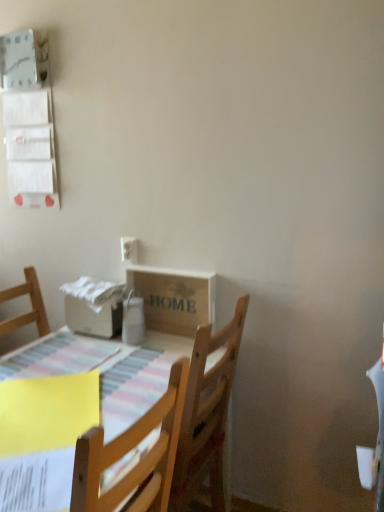
In order to face wooden table at lower left, should I rotate leftwards or rightwards?

You should look left and rotate roughly 14.095 degrees.

The width and height of the screenshot is (384, 512). In order to click on wooden table at lower left in this screenshot , I will do `click(105, 370)`.

Between wooden crate at center and wooden table at lower left, which one is positioned behind?

wooden crate at center is further from the camera.

Is wooden crate at center facing away from wooden table at lower left?

No, wooden table at lower left is not at the back of wooden crate at center.

This screenshot has width=384, height=512. Find the location of `table in front of the wooden crate at center`. table in front of the wooden crate at center is located at coordinates (105, 370).

Is wooden crate at center taller than white plastic electric outlet at upper left?

Indeed, wooden crate at center has a greater height compared to white plastic electric outlet at upper left.

Can you confirm if wooden crate at center is bigger than white plastic electric outlet at upper left?

Indeed, wooden crate at center has a larger size compared to white plastic electric outlet at upper left.

From a real-world perspective, is wooden crate at center over white plastic electric outlet at upper left?

No.

Locate an element on the screen. cardboard box below the white plastic electric outlet at upper left (from a real-world perspective) is located at coordinates (174, 298).

Is wooden table at lower left turned away from wooden crate at center?

No, wooden crate at center is not at the back of wooden table at lower left.

From a real-world perspective, is wooden table at lower left under wooden crate at center?

Yes.

Is point (122, 344) closer or farther from the camera than point (204, 297)?

Point (122, 344) is positioned farther from the camera compared to point (204, 297).

Can you confirm if wooden table at lower left is smaller than wooden crate at center?

Actually, wooden table at lower left might be larger than wooden crate at center.

Looking at this image, from the image's perspective, is white plastic electric outlet at upper left under wooden table at lower left?

Incorrect, from the image's perspective, white plastic electric outlet at upper left is higher than wooden table at lower left.

Locate an element on the screen. This screenshot has width=384, height=512. electric outlet that appears on the right of wooden table at lower left is located at coordinates (129, 250).

Is white plastic electric outlet at upper left with wooden table at lower left?

No, white plastic electric outlet at upper left is not beside wooden table at lower left.

Can you confirm if wooden table at lower left is wider than white plastic electric outlet at upper left?

Indeed, wooden table at lower left has a greater width compared to white plastic electric outlet at upper left.

From the image's perspective, which is above, wooden table at lower left or white plastic electric outlet at upper left?

white plastic electric outlet at upper left.

Who is more distant, wooden table at lower left or white plastic electric outlet at upper left?

Positioned behind is white plastic electric outlet at upper left.

Is wooden table at lower left bigger than white plastic electric outlet at upper left?

Yes.

From the picture: Who is shorter, white plastic electric outlet at upper left or wooden crate at center?

Standing shorter between the two is white plastic electric outlet at upper left.

Is white plastic electric outlet at upper left touching wooden crate at center?

They are not placed beside each other.

Considering the relative sizes of white plastic electric outlet at upper left and wooden crate at center in the image provided, is white plastic electric outlet at upper left smaller than wooden crate at center?

Indeed, white plastic electric outlet at upper left has a smaller size compared to wooden crate at center.

Is white plastic electric outlet at upper left oriented away from wooden crate at center?

That's not correct — white plastic electric outlet at upper left is not looking away from wooden crate at center.

This screenshot has height=512, width=384. What are the coordinates of `table in front of the wooden crate at center` in the screenshot? It's located at (105, 370).

Identify the location of cardboard box that is below the white plastic electric outlet at upper left (from the image's perspective). (174, 298).

Considering their positions, is wooden table at lower left positioned further to white plastic electric outlet at upper left than wooden crate at center?

Among the two, wooden table at lower left is located further to white plastic electric outlet at upper left.

Consider the image. Estimate the real-world distances between objects in this image. Which object is further from wooden crate at center, white plastic electric outlet at upper left or wooden table at lower left?

Based on the image, wooden table at lower left appears to be further to wooden crate at center.

Looking at the image, which one is located closer to white plastic electric outlet at upper left, wooden crate at center or wooden table at lower left?

wooden crate at center is positioned closer to the anchor white plastic electric outlet at upper left.

Looking at the image, which one is located further to wooden table at lower left, white plastic electric outlet at upper left or wooden crate at center?

white plastic electric outlet at upper left.

Considering their positions, is wooden table at lower left positioned closer to wooden crate at center than white plastic electric outlet at upper left?

The object closer to wooden crate at center is white plastic electric outlet at upper left.

Considering their positions, is wooden crate at center positioned closer to wooden table at lower left than white plastic electric outlet at upper left?

wooden crate at center is closer to wooden table at lower left.

Identify the location of cardboard box positioned between wooden table at lower left and white plastic electric outlet at upper left from near to far. The width and height of the screenshot is (384, 512). (174, 298).